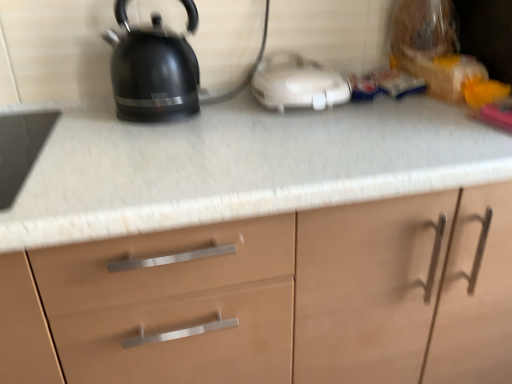
Question: Is black glossy kettle at upper left next to white plastic toaster at center and touching it?

Choices:
 (A) yes
 (B) no

Answer: (B)

Question: From a real-world perspective, does black glossy kettle at upper left sit lower than white plastic toaster at center?

Choices:
 (A) no
 (B) yes

Answer: (A)

Question: From a real-world perspective, is black glossy kettle at upper left physically above white plastic toaster at center?

Choices:
 (A) yes
 (B) no

Answer: (A)

Question: Is the position of black glossy kettle at upper left less distant than that of white plastic toaster at center?

Choices:
 (A) yes
 (B) no

Answer: (A)

Question: Does black glossy kettle at upper left have a greater height compared to white plastic toaster at center?

Choices:
 (A) no
 (B) yes

Answer: (B)

Question: Is white plastic toaster at center completely or partially inside black glossy kettle at upper left?

Choices:
 (A) yes
 (B) no

Answer: (B)

Question: Can you confirm if black glossy kettle at upper left is positioned to the left of matte wood cabinet at center?

Choices:
 (A) yes
 (B) no

Answer: (A)

Question: Could you tell me if black glossy kettle at upper left is facing matte wood cabinet at center?

Choices:
 (A) no
 (B) yes

Answer: (A)

Question: Is black glossy kettle at upper left with matte wood cabinet at center?

Choices:
 (A) yes
 (B) no

Answer: (B)

Question: Is black glossy kettle at upper left positioned with its back to matte wood cabinet at center?

Choices:
 (A) no
 (B) yes

Answer: (A)

Question: Does black glossy kettle at upper left have a lesser height compared to matte wood cabinet at center?

Choices:
 (A) yes
 (B) no

Answer: (A)

Question: Is black glossy kettle at upper left not near matte wood cabinet at center?

Choices:
 (A) yes
 (B) no

Answer: (B)

Question: Is white plastic toaster at center positioned with its back to matte wood cabinet at center?

Choices:
 (A) yes
 (B) no

Answer: (B)